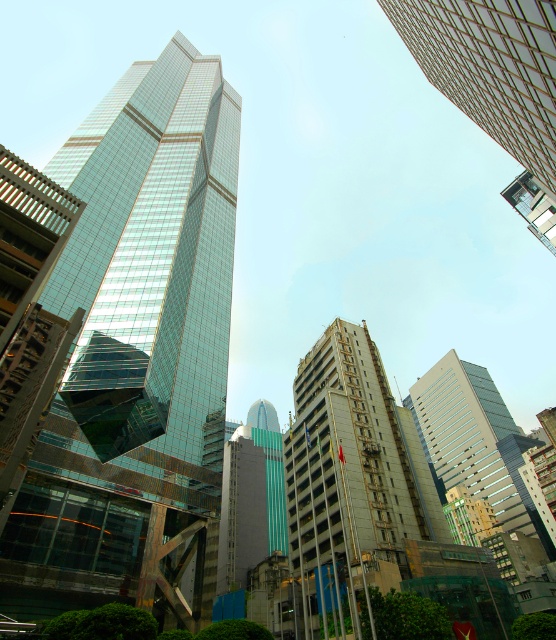
Between point (322, 356) and point (449, 442), which one is positioned behind?

The point (449, 442) is behind.

Is beige concrete building at center wider than matte glass building at center?

No, beige concrete building at center is not wider than matte glass building at center.

Where is `beige concrete building at center`? The width and height of the screenshot is (556, 640). beige concrete building at center is located at coordinates (351, 476).

Between point (207, 483) and point (499, 474), which one is positioned behind?

Positioned behind is point (499, 474).

Does point (34, 579) come closer to viewer compared to point (430, 396)?

Yes, point (34, 579) is in front of point (430, 396).

The width and height of the screenshot is (556, 640). Identify the location of transparent glass skyscraper at center. (136, 355).

Is beige concrete building at center bigger than glassy reflective skyscraper at upper right?

Actually, beige concrete building at center might be smaller than glassy reflective skyscraper at upper right.

Can you confirm if beige concrete building at center is positioned to the right of glassy reflective skyscraper at upper right?

In fact, beige concrete building at center is to the left of glassy reflective skyscraper at upper right.

Is point (364, 374) less distant than point (492, 38)?

No, (364, 374) is further to viewer.

This screenshot has width=556, height=640. Identify the location of beige concrete building at center. (351, 476).